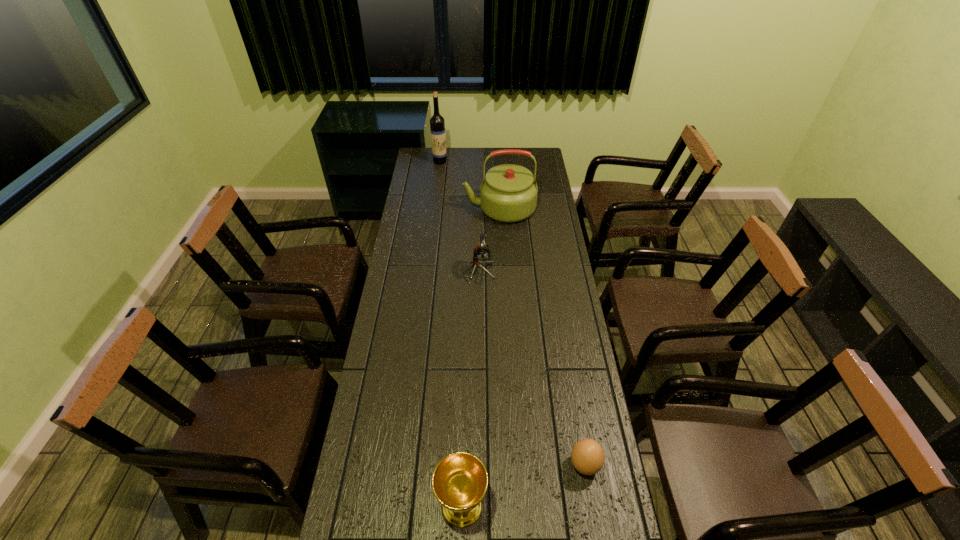
At what (x,y) coordinates should I click in order to perform the action: click on vacant region located at the spout of the fourth nearest object. Please return your answer as a coordinate pair (x, y). The height and width of the screenshot is (540, 960). Looking at the image, I should click on (405, 209).

The image size is (960, 540). Identify the location of free space located 0.340m on the front of the third farthest object. pyautogui.click(x=479, y=355).

Identify the location of vacant space positioned on the back of the chalice. (465, 394).

What are the coordinates of `free region located on the back of the boiled egg` in the screenshot? It's located at (566, 356).

Where is `object located at the far edge`? This screenshot has width=960, height=540. object located at the far edge is located at coordinates (437, 124).

At what (x,y) coordinates should I click in order to perform the action: click on object located at the left edge. Please return your answer as a coordinate pair (x, y). This screenshot has width=960, height=540. Looking at the image, I should click on (437, 124).

This screenshot has height=540, width=960. Identify the location of kettle present at the right edge. (508, 193).

The height and width of the screenshot is (540, 960). I want to click on boiled egg that is at the right edge, so click(x=587, y=455).

Find the location of a particular element. object present at the far left corner is located at coordinates (437, 124).

In the image, there is a desktop. Identify the location of vacant space at the far edge. point(469,160).